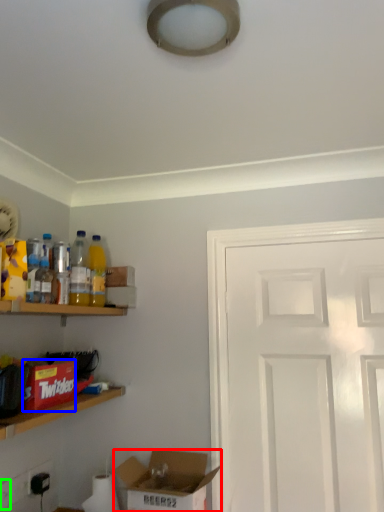
Question: Considering the real-world distances, which object is farthest from box (highlighted by a red box)? box (highlighted by a blue box) or electric outlet (highlighted by a green box)?

Choices:
 (A) box
 (B) electric outlet

Answer: (B)